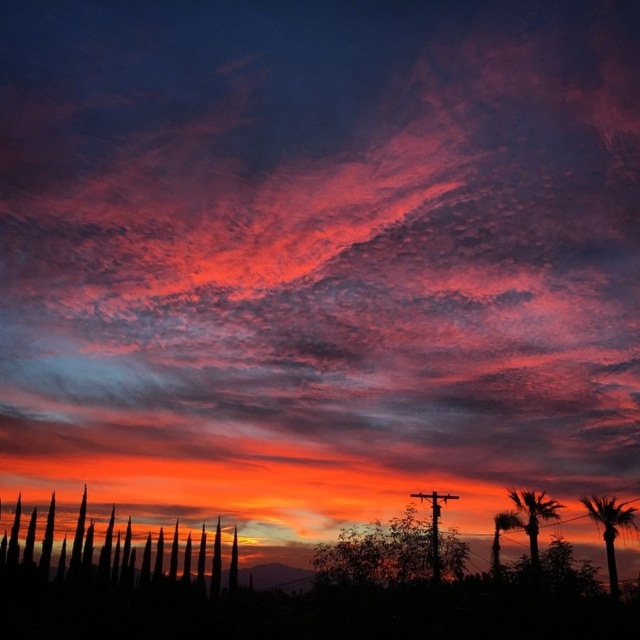
Question: Is silky brown palm tree at lower right below green leafy palm tree at center-right?

Choices:
 (A) yes
 (B) no

Answer: (B)

Question: Does green leafy tree at center appear over green leafy palm tree at center-right?

Choices:
 (A) no
 (B) yes

Answer: (B)

Question: Which object is farther from the camera taking this photo?

Choices:
 (A) green leafy tree at center
 (B) green leafy palm tree at center-right
 (C) silky black trees at lower left

Answer: (C)

Question: Which object appears closest to the camera in this image?

Choices:
 (A) silky brown palm tree at lower right
 (B) silky black trees at lower left
 (C) green leafy tree at center
 (D) silky brown palm tree at right

Answer: (D)

Question: Which point is closer to the camera?

Choices:
 (A) (611, 506)
 (B) (499, 545)
 (C) (456, 579)

Answer: (C)

Question: Can you confirm if silky black trees at lower left is positioned above silky brown palm tree at right?

Choices:
 (A) no
 (B) yes

Answer: (A)